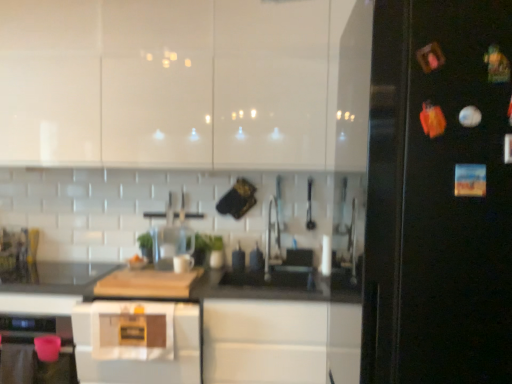
Question: From the image's perspective, is white glossy cabinets at upper center above clear glass blender at center?

Choices:
 (A) no
 (B) yes

Answer: (B)

Question: Considering the relative positions of white glossy cabinets at upper center and clear glass blender at center in the image provided, is white glossy cabinets at upper center to the left of clear glass blender at center from the viewer's perspective?

Choices:
 (A) yes
 (B) no

Answer: (A)

Question: From a real-world perspective, is white glossy cabinets at upper center positioned under clear glass blender at center based on gravity?

Choices:
 (A) yes
 (B) no

Answer: (B)

Question: Does white glossy cabinets at upper center have a greater height compared to clear glass blender at center?

Choices:
 (A) no
 (B) yes

Answer: (B)

Question: Is white glossy cabinets at upper center positioned behind clear glass blender at center?

Choices:
 (A) no
 (B) yes

Answer: (A)

Question: Is white glossy cabinets at upper center positioned with its back to clear glass blender at center?

Choices:
 (A) no
 (B) yes

Answer: (A)

Question: Does black glossy fridge at right appear on the right side of white glossy cabinets at upper center?

Choices:
 (A) yes
 (B) no

Answer: (A)

Question: From the image's perspective, is black glossy fridge at right located beneath white glossy cabinets at upper center?

Choices:
 (A) yes
 (B) no

Answer: (A)

Question: Can you confirm if black glossy fridge at right is shorter than white glossy cabinets at upper center?

Choices:
 (A) yes
 (B) no

Answer: (B)

Question: Does black glossy fridge at right have a greater height compared to white glossy cabinets at upper center?

Choices:
 (A) no
 (B) yes

Answer: (B)

Question: From a real-world perspective, is black glossy fridge at right beneath white glossy cabinets at upper center?

Choices:
 (A) no
 (B) yes

Answer: (B)

Question: Is black glossy fridge at right facing towards white glossy cabinets at upper center?

Choices:
 (A) yes
 (B) no

Answer: (B)

Question: Can you confirm if white glossy cabinets at upper center is shorter than black matte countertop at center?

Choices:
 (A) no
 (B) yes

Answer: (A)